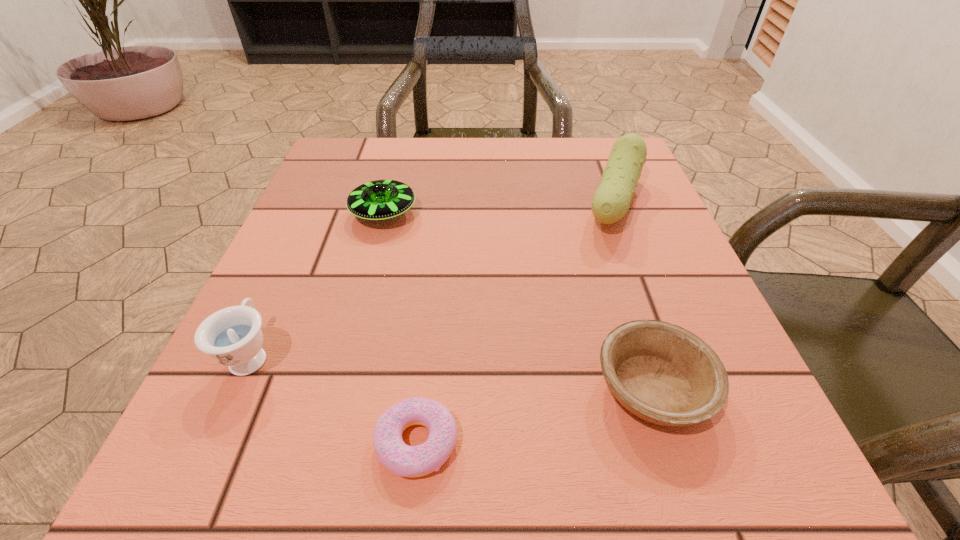
Where is `object that is at the near right corner`? The width and height of the screenshot is (960, 540). object that is at the near right corner is located at coordinates (662, 373).

The width and height of the screenshot is (960, 540). What are the coordinates of `vacant space at the far edge` in the screenshot? It's located at (523, 163).

The height and width of the screenshot is (540, 960). In the image, there is a desktop. In order to click on vacant space at the near edge in this screenshot , I will do point(635,455).

I want to click on free spot at the left edge of the desktop, so click(331, 213).

You are a GUI agent. You are given a task and a screenshot of the screen. Output one action in this format:
    pyautogui.click(x=<x>, y=<y>)
    Task: Click on the vacant area at the right edge of the desktop
    This screenshot has width=960, height=540.
    Given the screenshot: What is the action you would take?
    pyautogui.click(x=642, y=220)

Where is `vacant area at the far left corner of the desktop`? Image resolution: width=960 pixels, height=540 pixels. vacant area at the far left corner of the desktop is located at coordinates (370, 165).

Identify the location of vacant point at the near left corner. (188, 495).

Locate an element on the screen. This screenshot has width=960, height=540. free space at the far right corner of the desktop is located at coordinates (x=588, y=191).

You are a GUI agent. You are given a task and a screenshot of the screen. Output one action in this format:
    pyautogui.click(x=<x>, y=<y>)
    Task: Click on the vacant space in between the saucer and the bowl
    
    Given the screenshot: What is the action you would take?
    (x=518, y=301)

Locate an element on the screen. vacant space that's between the bowl and the doughnut is located at coordinates [x=535, y=415].